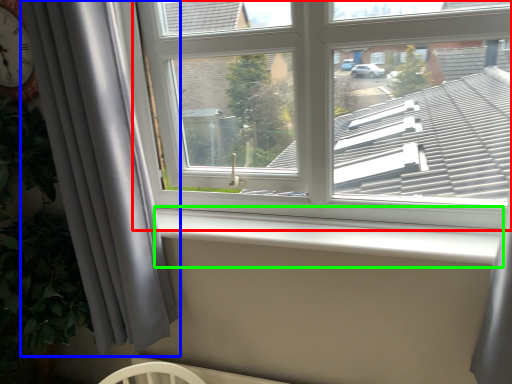
Question: Considering the real-world distances, which object is farthest from window (highlighted by a red box)? curtain (highlighted by a blue box) or window sill (highlighted by a green box)?

Choices:
 (A) curtain
 (B) window sill

Answer: (A)